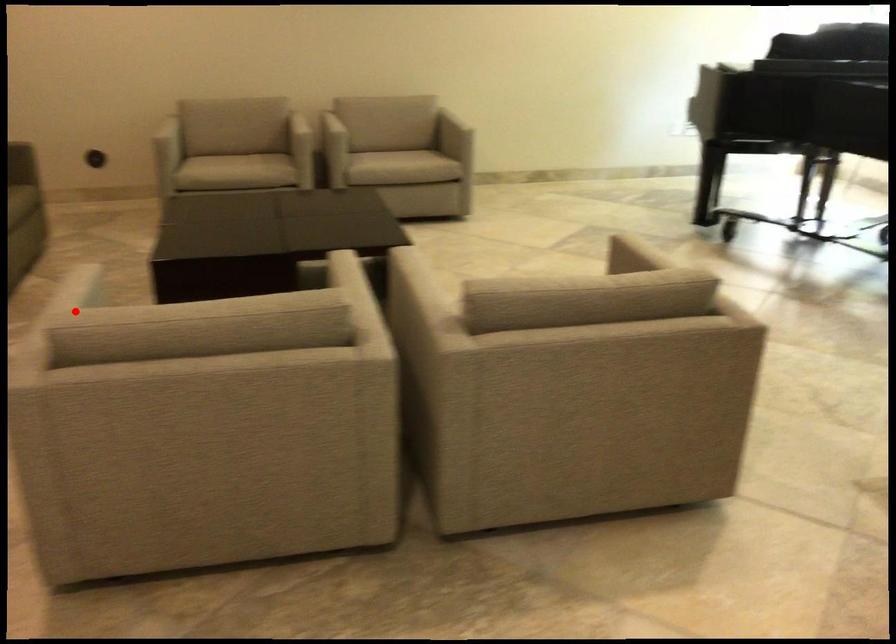
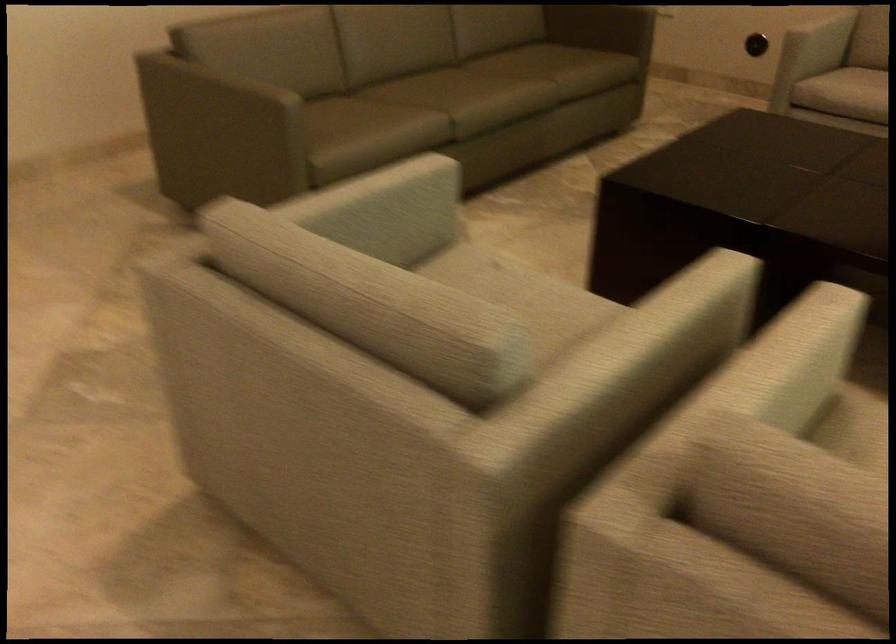
Question: I am providing you with two images of the same scene from different viewpoints. A red point is marked on the first image. At the location where the point appears in image 1, is it still visible in image 2?

Choices:
 (A) Yes
 (B) No

Answer: (A)